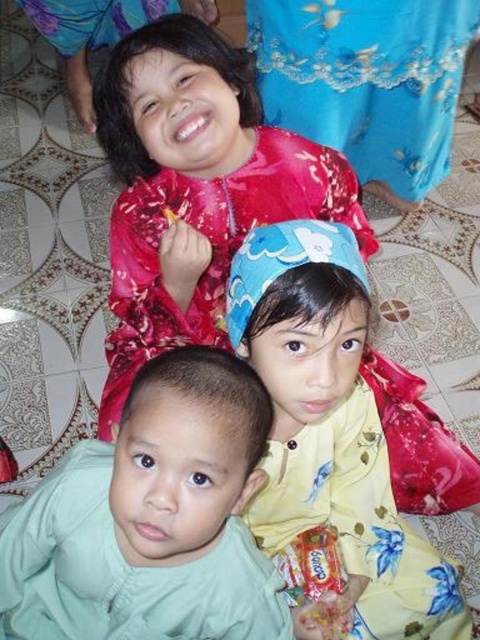
You are a photographer trying to capture a closeup of the shiny red dress at upper center. Since the light green fabric at center is blocking part of the dress, can you estimate whether the dress is bigger or smaller than the fabric?

The light green fabric at center has a smaller size compared to shiny red dress at upper center, so the shiny red dress at upper center is bigger than the light green fabric at center.

Based on the scene description, which object is shorter between the light green fabric at center and the shiny red dress at upper center?

The light green fabric at center is shorter than the shiny red dress at upper center.

You are a tailor who needs to decide which fabric to use for a new dress. You have the light green fabric at center and the yellow floral dress at center. Which fabric is more suitable if you need a thicker material?

The yellow floral dress at center is thicker than the light green fabric at center, so it would be more suitable for a thicker material.